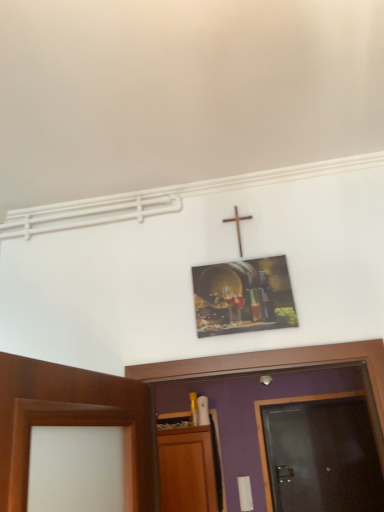
Question: Relative to dark wood door at right, is metallic wine barrel at upper center in front or behind?

Choices:
 (A) behind
 (B) front

Answer: (B)

Question: Does point (264, 287) appear closer or farther from the camera than point (357, 502)?

Choices:
 (A) farther
 (B) closer

Answer: (B)

Question: Estimate the real-world distances between objects in this image. Which object is closer to the wooden cross at upper center?

Choices:
 (A) dark wood door at right
 (B) metallic wine barrel at upper center

Answer: (B)

Question: Which object is positioned farthest from the metallic wine barrel at upper center?

Choices:
 (A) dark wood door at right
 (B) wooden cross at upper center

Answer: (A)